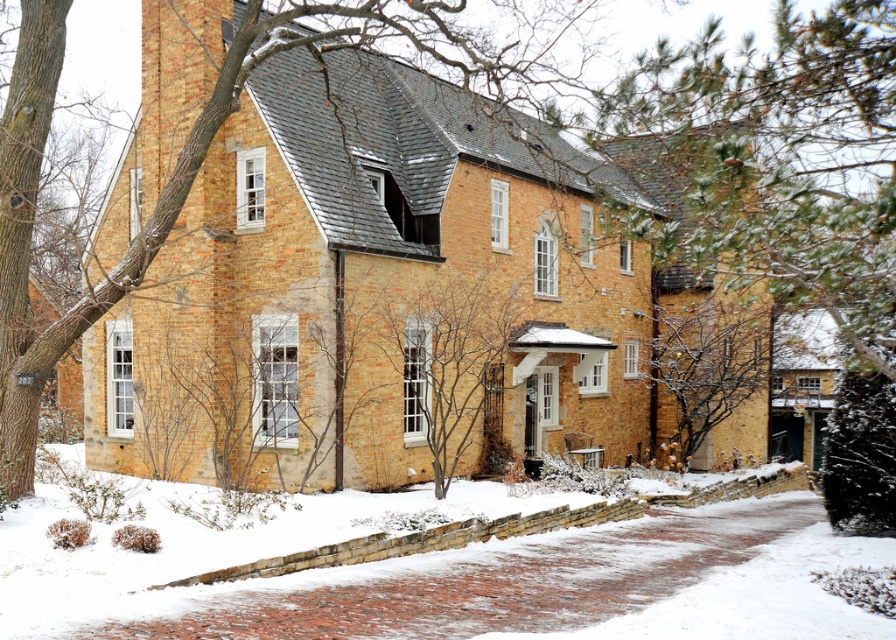
Question: Which point is farther to the camera?

Choices:
 (A) (419, 358)
 (B) (498, 634)

Answer: (A)

Question: Which object appears farthest from the camera in this image?

Choices:
 (A) white powdery snow at lower center
 (B) bare branches at center

Answer: (B)

Question: Is white powdery snow at lower center to the left of bare branches at center from the viewer's perspective?

Choices:
 (A) no
 (B) yes

Answer: (A)

Question: Observing the image, what is the correct spatial positioning of white powdery snow at lower center in reference to bare branches at center?

Choices:
 (A) below
 (B) above

Answer: (A)

Question: Is white powdery snow at lower center bigger than bare branches at center?

Choices:
 (A) yes
 (B) no

Answer: (A)